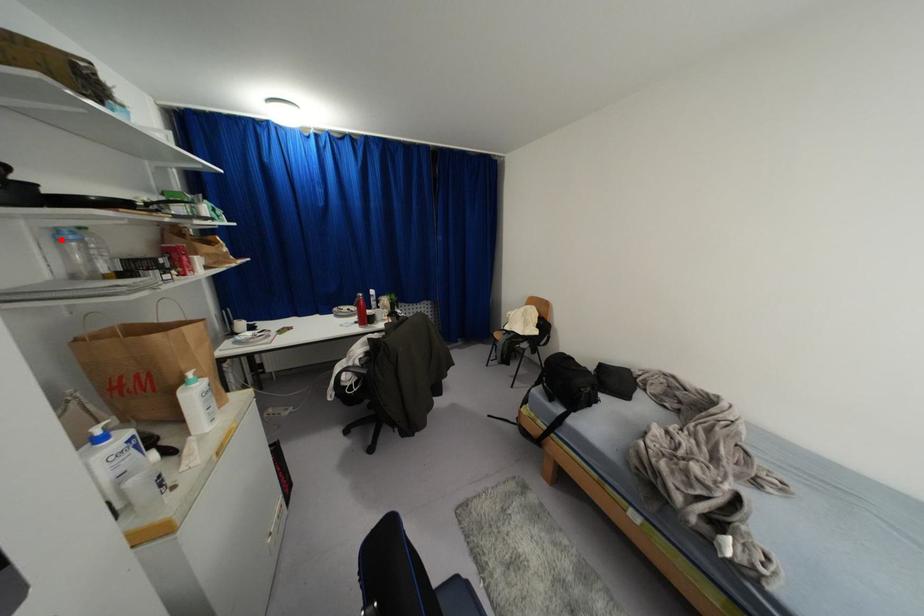
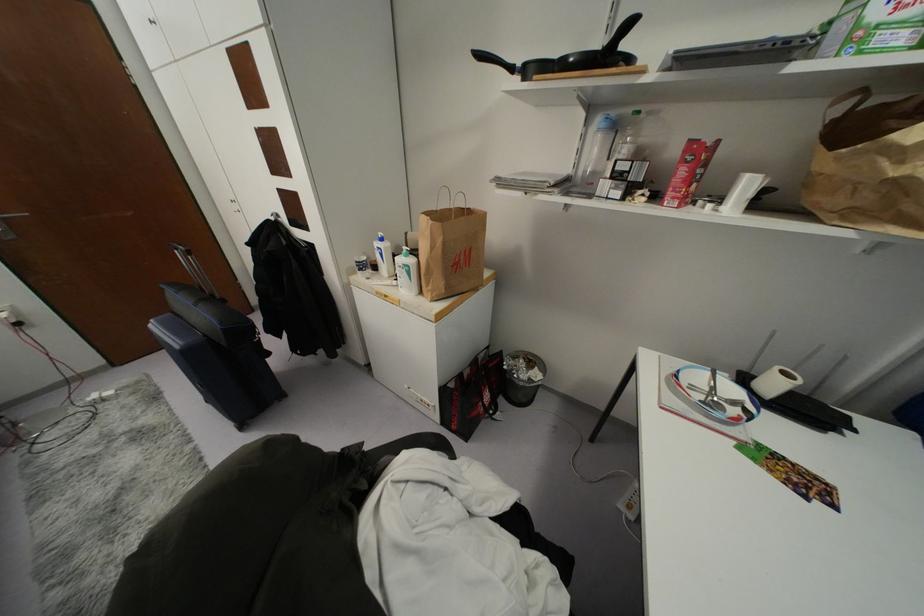
Question: A red point is marked in image1. In image2, is the corresponding 3D point closer to the camera or farther? Reply with the corresponding letter.

Choices:
 (A) The corresponding 3D point is closer.
 (B) The corresponding 3D point is farther.

Answer: (A)